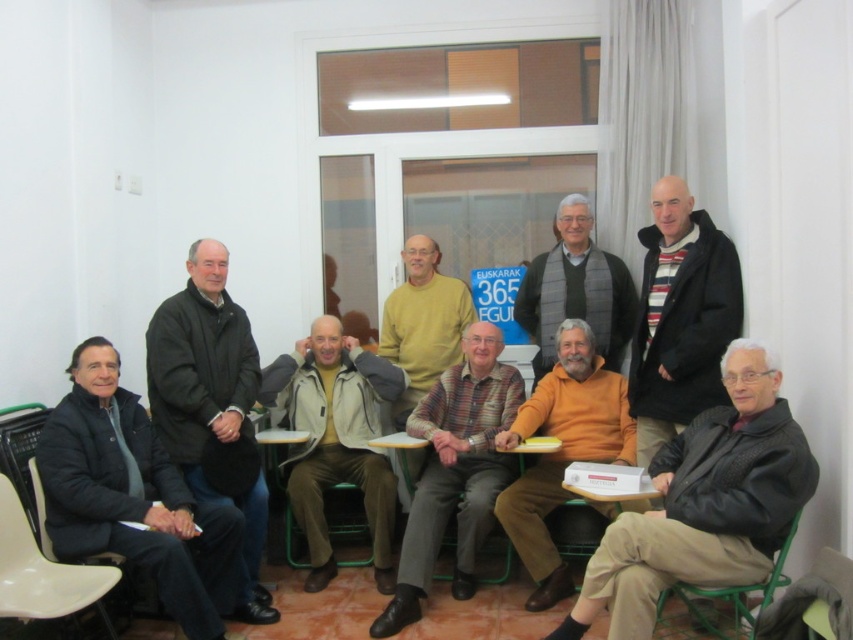
You are organizing a clothing donation drive and need to categorize items by size. You have two items from the image to sort. Which one is narrower between the striped wool sweater at center and the gray scarf at center?

The striped wool sweater at center is narrower than the gray scarf at center.